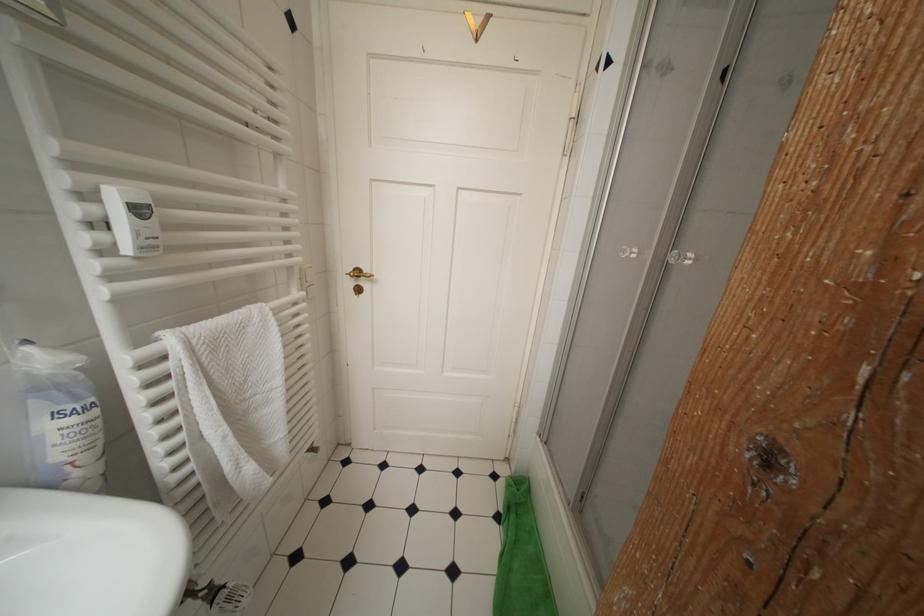
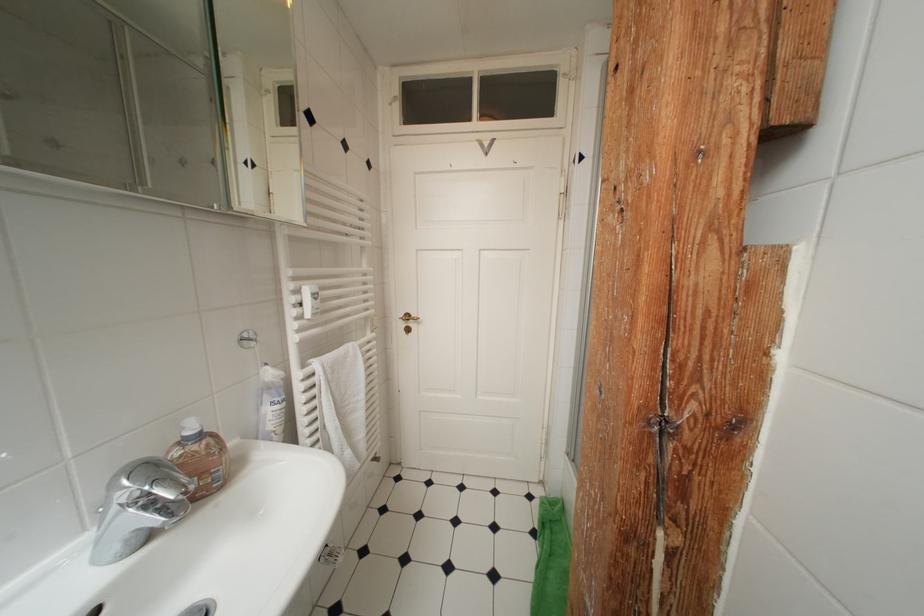
In the second image, find the point that corresponds to (34,345) in the first image.

(274, 368)